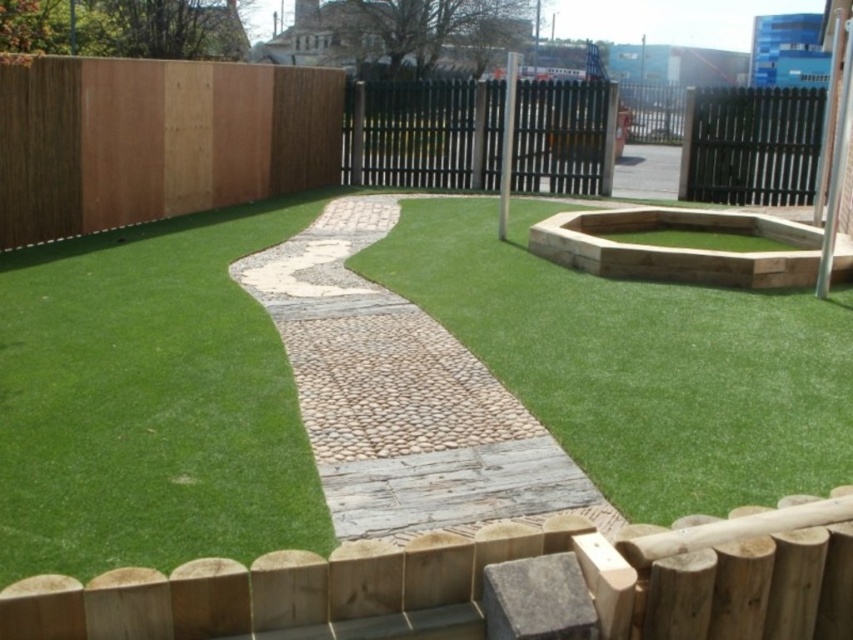
Can you confirm if black metal fence at center is shorter than black metal fence at upper right?

Indeed, black metal fence at center has a lesser height compared to black metal fence at upper right.

Find the location of a particular element. This screenshot has height=640, width=853. black metal fence at center is located at coordinates (422, 132).

You are a GUI agent. You are given a task and a screenshot of the screen. Output one action in this format:
    pyautogui.click(x=<x>, y=<y>)
    Task: Click on the black metal fence at center
    
    Given the screenshot: What is the action you would take?
    pyautogui.click(x=422, y=132)

Does green artificial turf at left appear on the right side of black metal fence at upper right?

No, green artificial turf at left is not to the right of black metal fence at upper right.

Who is more forward, (138, 500) or (732, 204)?

Point (138, 500) is more forward.

Locate an element on the screen. This screenshot has height=640, width=853. green artificial turf at left is located at coordinates (149, 401).

Identify the location of green artificial turf at center. (637, 362).

Between green artificial turf at center and black metal fence at upper right, which one is positioned lower?

green artificial turf at center is lower down.

Identify the location of green artificial turf at center. (637, 362).

Where is `green artificial turf at center`? green artificial turf at center is located at coordinates (637, 362).